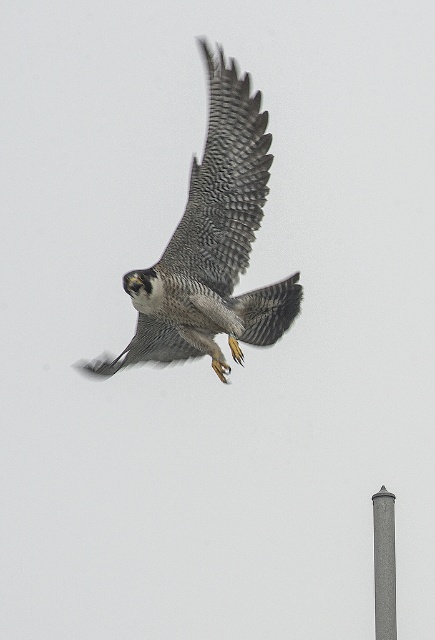
Question: Which point appears farthest from the camera in this image?

Choices:
 (A) (392, 589)
 (B) (271, 161)

Answer: (B)

Question: Is speckled feathered eagle at center smaller than gray textured wing at center?

Choices:
 (A) no
 (B) yes

Answer: (A)

Question: Which object is positioned closest to the gray textured wing at center?

Choices:
 (A) speckled feathered eagle at center
 (B) gray concrete pole at lower right

Answer: (A)

Question: Is speckled feathered eagle at center in front of gray concrete pole at lower right?

Choices:
 (A) yes
 (B) no

Answer: (B)

Question: Is the position of speckled feathered eagle at center less distant than that of gray concrete pole at lower right?

Choices:
 (A) yes
 (B) no

Answer: (B)

Question: Estimate the real-world distances between objects in this image. Which object is closer to the gray concrete pole at lower right?

Choices:
 (A) speckled feathered eagle at center
 (B) gray textured wing at center

Answer: (A)